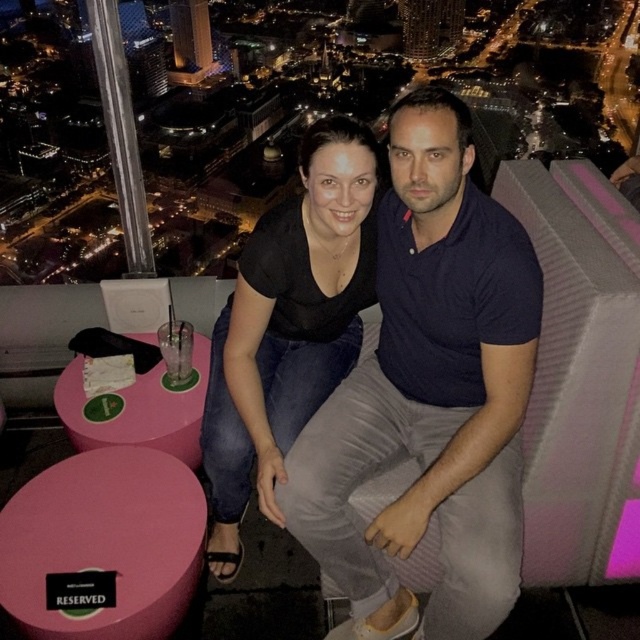
Question: Which point is farther from the camera taking this photo?

Choices:
 (A) click(x=422, y=301)
 (B) click(x=236, y=570)

Answer: (A)

Question: Is dark blue cotton shirt at center below black matte shirt at center?

Choices:
 (A) no
 (B) yes

Answer: (A)

Question: Among these points, which one is farthest from the camera?

Choices:
 (A) (257, 349)
 (B) (385, 278)

Answer: (B)

Question: Which point is closer to the camera taking this photo?

Choices:
 (A) (422, 464)
 (B) (349, 120)

Answer: (A)

Question: Is dark blue cotton shirt at center above black matte shirt at center?

Choices:
 (A) no
 (B) yes

Answer: (B)

Question: Is dark blue cotton shirt at center bigger than black matte shirt at center?

Choices:
 (A) yes
 (B) no

Answer: (A)